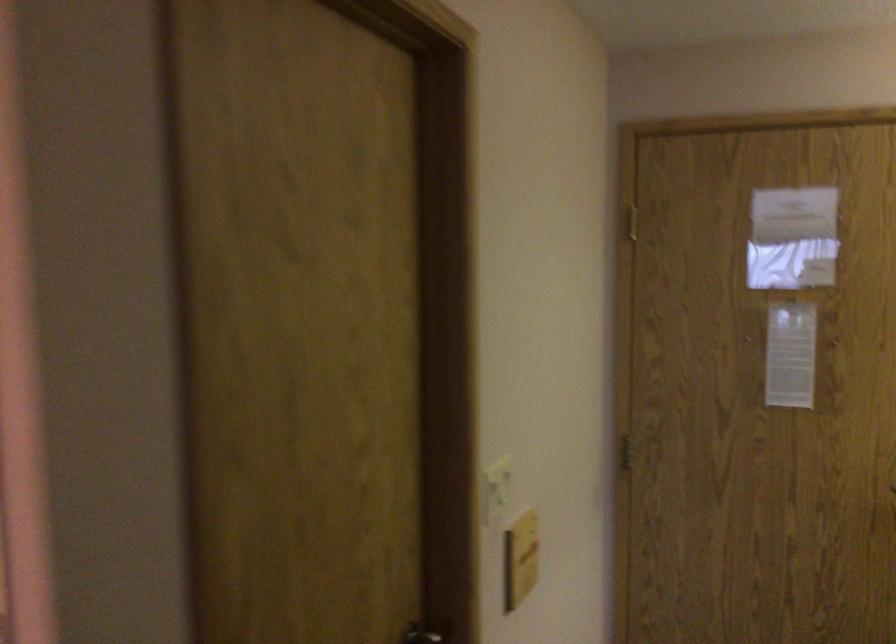
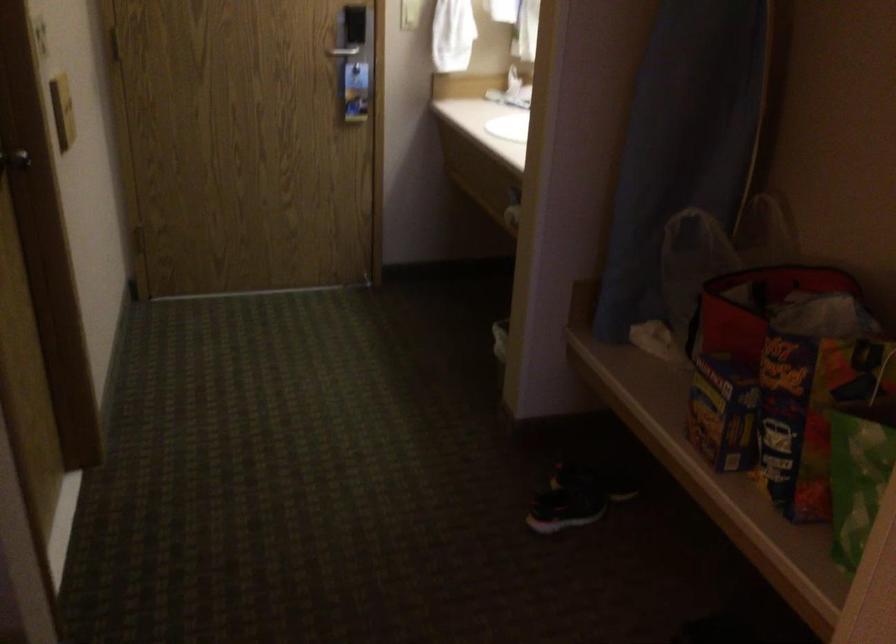
How did the camera likely rotate?

The rotation direction of the camera is right-down.